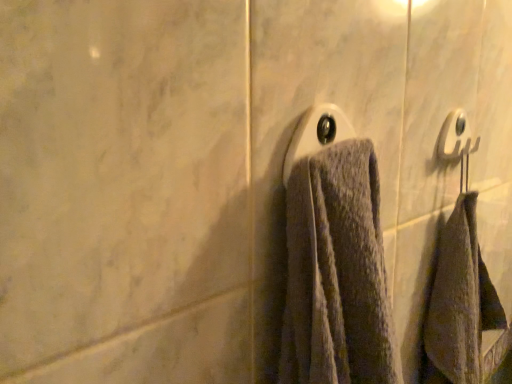
Measure the distance between point (454, 158) and camera.

Point (454, 158) is 24.06 inches away from camera.

Looking at this image, what is the approximate height of white plastic towel bar at upper right, which appears as the 1th towel bar when viewed from the right?

It is 3.00 inches.

What do you see at coordinates (453, 135) in the screenshot? I see `white plastic towel bar at upper right, which appears as the 1th towel bar when viewed from the back` at bounding box center [453, 135].

Find the location of a particular element. The height and width of the screenshot is (384, 512). white plastic towel bar at upper right, arranged as the 2th towel bar when viewed from the left is located at coordinates (453, 135).

Identify the location of white plastic towel bar at center, which ranks as the first towel bar in left-to-right order. The height and width of the screenshot is (384, 512). (316, 134).

In order to face white plastic towel bar at center, which ranks as the first towel bar in left-to-right order, should I rotate leftwards or rightwards?

You should look right and rotate roughly 10.247 degrees.

The height and width of the screenshot is (384, 512). What do you see at coordinates (316, 134) in the screenshot?
I see `white plastic towel bar at center, the second towel bar when ordered from back to front` at bounding box center [316, 134].

Where is `white plastic towel bar at upper right, arranged as the 2th towel bar when viewed from the left`? The height and width of the screenshot is (384, 512). white plastic towel bar at upper right, arranged as the 2th towel bar when viewed from the left is located at coordinates (453, 135).

Looking at this image, is white plastic towel bar at upper right, which appears as the 1th towel bar when viewed from the back, at the left side of white plastic towel bar at center, which ranks as the first towel bar in left-to-right order?

No, white plastic towel bar at upper right, which appears as the 1th towel bar when viewed from the back, is not to the left of white plastic towel bar at center, which ranks as the first towel bar in left-to-right order.

Is white plastic towel bar at upper right, arranged as the 2th towel bar when viewed from the left, further to the viewer compared to white plastic towel bar at center, which ranks as the first towel bar in left-to-right order?

Yes, it is behind white plastic towel bar at center, which ranks as the first towel bar in left-to-right order.

Considering the positions of points (451, 130) and (323, 122), is point (451, 130) closer to camera compared to point (323, 122)?

No, it is behind (323, 122).

From the image's perspective, is white plastic towel bar at upper right, the 2th towel bar in the front-to-back sequence, beneath white plastic towel bar at center, the second towel bar when ordered from back to front?

No, from the image's perspective, white plastic towel bar at upper right, the 2th towel bar in the front-to-back sequence, is not below white plastic towel bar at center, the second towel bar when ordered from back to front.

Based on the photo, from a real-world perspective, is white plastic towel bar at upper right, arranged as the 2th towel bar when viewed from the left, above or below white plastic towel bar at center, which ranks as the first towel bar in left-to-right order?

Clearly, from a real-world perspective, white plastic towel bar at upper right, arranged as the 2th towel bar when viewed from the left, is below white plastic towel bar at center, which ranks as the first towel bar in left-to-right order.

Which object is wider, white plastic towel bar at upper right, which appears as the 1th towel bar when viewed from the right, or white plastic towel bar at center, the second towel bar when ordered from back to front?

Wider between the two is white plastic towel bar at center, the second towel bar when ordered from back to front.

Based on the photo, is white plastic towel bar at upper right, arranged as the 2th towel bar when viewed from the left, taller or shorter than white plastic towel bar at center, the second towel bar when ordered from back to front?

Clearly, white plastic towel bar at upper right, arranged as the 2th towel bar when viewed from the left, is shorter compared to white plastic towel bar at center, the second towel bar when ordered from back to front.

Does white plastic towel bar at upper right, which appears as the 1th towel bar when viewed from the back, have a smaller size compared to white plastic towel bar at center, the second towel bar when ordered from back to front?

Yes.

Is white plastic towel bar at upper right, the 2th towel bar in the front-to-back sequence, spatially inside white plastic towel bar at center, the second towel bar when ordered from back to front, or outside of it?

white plastic towel bar at upper right, the 2th towel bar in the front-to-back sequence, is located beyond the bounds of white plastic towel bar at center, the second towel bar when ordered from back to front.

Is white plastic towel bar at upper right, the 2th towel bar in the front-to-back sequence, directly adjacent to white plastic towel bar at center, the second towel bar when ordered from back to front?

There is a gap between white plastic towel bar at upper right, the 2th towel bar in the front-to-back sequence, and white plastic towel bar at center, the second towel bar when ordered from back to front.

Could you tell me if white plastic towel bar at upper right, the 2th towel bar in the front-to-back sequence, is facing white plastic towel bar at center, which ranks as the second towel bar in right-to-left order?

No.

How many degrees apart are the facing directions of white plastic towel bar at upper right, which appears as the 1th towel bar when viewed from the right, and white plastic towel bar at center, which ranks as the second towel bar in right-to-left order?

There is a 0.00162-degree angle between the facing directions of white plastic towel bar at upper right, which appears as the 1th towel bar when viewed from the right, and white plastic towel bar at center, which ranks as the second towel bar in right-to-left order.

How distant is white plastic towel bar at upper right, the 2th towel bar in the front-to-back sequence, from white plastic towel bar at center, which ranks as the second towel bar in right-to-left order?

white plastic towel bar at upper right, the 2th towel bar in the front-to-back sequence, and white plastic towel bar at center, which ranks as the second towel bar in right-to-left order, are 10.88 inches apart from each other.

Locate an element on the screen. towel bar lying behind the white plastic towel bar at center, the second towel bar when ordered from back to front is located at coordinates (453, 135).

Which is more to the left, white plastic towel bar at center, the 1th towel bar from the front, or white plastic towel bar at upper right, which appears as the 1th towel bar when viewed from the back?

Positioned to the left is white plastic towel bar at center, the 1th towel bar from the front.

Relative to white plastic towel bar at upper right, arranged as the 2th towel bar when viewed from the left, is white plastic towel bar at center, the 1th towel bar from the front, in front or behind?

Visually, white plastic towel bar at center, the 1th towel bar from the front, is located in front of white plastic towel bar at upper right, arranged as the 2th towel bar when viewed from the left.

Does point (350, 126) come in front of point (450, 153)?

Yes, it is.

From the image's perspective, which one is positioned higher, white plastic towel bar at center, the second towel bar when ordered from back to front, or white plastic towel bar at upper right, which appears as the 1th towel bar when viewed from the back?

white plastic towel bar at upper right, which appears as the 1th towel bar when viewed from the back, from the image's perspective.

From a real-world perspective, is white plastic towel bar at center, which ranks as the second towel bar in right-to-left order, over white plastic towel bar at upper right, which appears as the 1th towel bar when viewed from the right?

Indeed, from a real-world perspective, white plastic towel bar at center, which ranks as the second towel bar in right-to-left order, stands above white plastic towel bar at upper right, which appears as the 1th towel bar when viewed from the right.

Can you confirm if white plastic towel bar at center, which ranks as the second towel bar in right-to-left order, is wider than white plastic towel bar at upper right, which appears as the 1th towel bar when viewed from the back?

Yes, white plastic towel bar at center, which ranks as the second towel bar in right-to-left order, is wider than white plastic towel bar at upper right, which appears as the 1th towel bar when viewed from the back.

Which of these two, white plastic towel bar at center, which ranks as the second towel bar in right-to-left order, or white plastic towel bar at upper right, arranged as the 2th towel bar when viewed from the left, stands taller?

Standing taller between the two is white plastic towel bar at center, which ranks as the second towel bar in right-to-left order.

Considering the relative sizes of white plastic towel bar at center, the second towel bar when ordered from back to front, and white plastic towel bar at upper right, which appears as the 1th towel bar when viewed from the right, in the image provided, is white plastic towel bar at center, the second towel bar when ordered from back to front, bigger than white plastic towel bar at upper right, which appears as the 1th towel bar when viewed from the right,?

Yes, white plastic towel bar at center, the second towel bar when ordered from back to front, is bigger than white plastic towel bar at upper right, which appears as the 1th towel bar when viewed from the right.

Could white plastic towel bar at upper right, arranged as the 2th towel bar when viewed from the left, be considered to be inside white plastic towel bar at center, which ranks as the first towel bar in left-to-right order?

Definitely not — white plastic towel bar at upper right, arranged as the 2th towel bar when viewed from the left, is not inside white plastic towel bar at center, which ranks as the first towel bar in left-to-right order.

Is white plastic towel bar at center, which ranks as the first towel bar in left-to-right order, not near white plastic towel bar at upper right, arranged as the 2th towel bar when viewed from the left?

No, white plastic towel bar at center, which ranks as the first towel bar in left-to-right order, is not far away from white plastic towel bar at upper right, arranged as the 2th towel bar when viewed from the left.

Is white plastic towel bar at center, the 1th towel bar from the front, positioned with its back to white plastic towel bar at upper right, which appears as the 1th towel bar when viewed from the right?

white plastic towel bar at center, the 1th towel bar from the front, is not turned away from white plastic towel bar at upper right, which appears as the 1th towel bar when viewed from the right.

How different are the orientations of white plastic towel bar at center, the second towel bar when ordered from back to front, and white plastic towel bar at upper right, which appears as the 1th towel bar when viewed from the right, in degrees?

The facing directions of white plastic towel bar at center, the second towel bar when ordered from back to front, and white plastic towel bar at upper right, which appears as the 1th towel bar when viewed from the right, are 0.00162 degrees apart.

Where is `towel bar directly beneath the white plastic towel bar at center, the 1th towel bar from the front (from a real-world perspective)`? This screenshot has width=512, height=384. towel bar directly beneath the white plastic towel bar at center, the 1th towel bar from the front (from a real-world perspective) is located at coordinates (453, 135).

In order to click on towel bar in front of the white plastic towel bar at upper right, which appears as the 1th towel bar when viewed from the back in this screenshot , I will do `click(316, 134)`.

The height and width of the screenshot is (384, 512). What are the coordinates of `towel bar that appears below the white plastic towel bar at upper right, arranged as the 2th towel bar when viewed from the left (from the image's perspective)` in the screenshot? It's located at (316, 134).